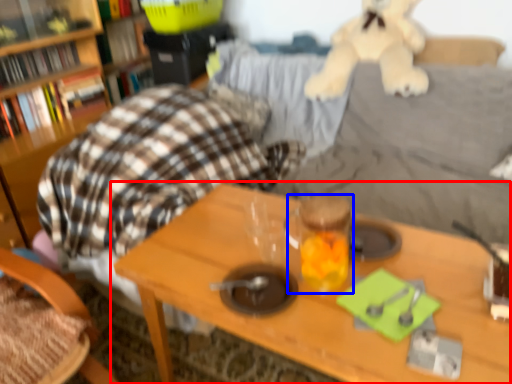
Question: Among these objects, which one is nearest to the camera, table (highlighted by a red box) or beverage (highlighted by a blue box)?

Choices:
 (A) table
 (B) beverage

Answer: (A)